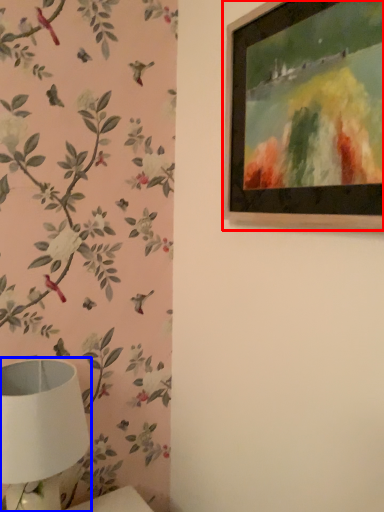
Question: Which of the following is the closest to the observer, picture frame (highlighted by a red box) or table lamp (highlighted by a blue box)?

Choices:
 (A) picture frame
 (B) table lamp

Answer: (A)